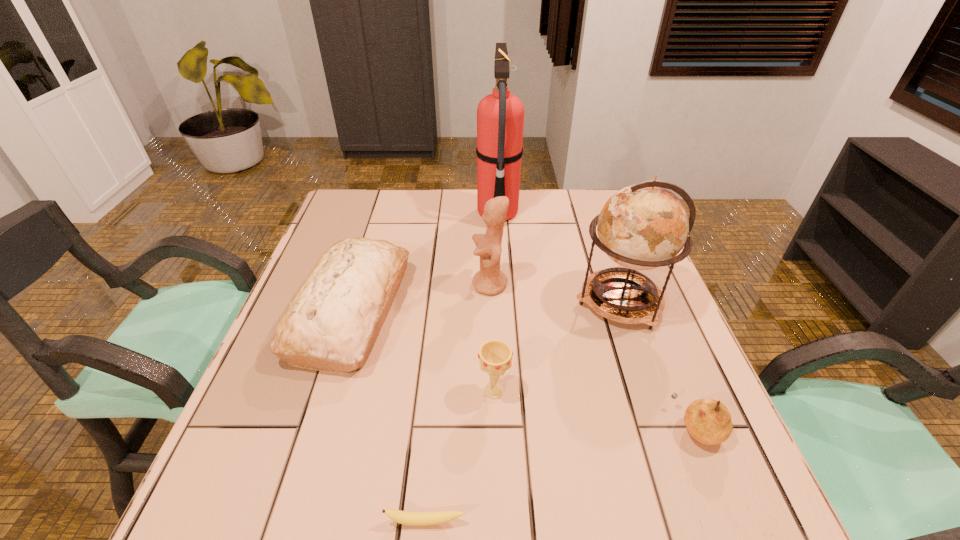
Identify the location of the farthest object. Image resolution: width=960 pixels, height=540 pixels. (500, 116).

Image resolution: width=960 pixels, height=540 pixels. I want to click on the tallest object, so click(x=500, y=116).

Where is `the second tallest object`? This screenshot has height=540, width=960. the second tallest object is located at coordinates (644, 226).

This screenshot has height=540, width=960. What are the coordinates of `the third tallest object` in the screenshot? It's located at (490, 280).

Locate an element on the screen. The width and height of the screenshot is (960, 540). bread is located at coordinates (332, 323).

In order to click on chalice in this screenshot , I will do `click(495, 356)`.

Find the location of a particular element. The height and width of the screenshot is (540, 960). the second shortest object is located at coordinates (708, 421).

You are a GUI agent. You are given a task and a screenshot of the screen. Output one action in this format:
    pyautogui.click(x=<x>, y=<y>)
    Task: Click on the shortest object
    The image size is (960, 540).
    Given the screenshot: What is the action you would take?
    pyautogui.click(x=407, y=518)

Find the location of a particular element. The height and width of the screenshot is (540, 960). banana is located at coordinates (407, 518).

Locate an element on the screen. free space located 0.270m at the nozzle of the fire extinguisher is located at coordinates (391, 213).